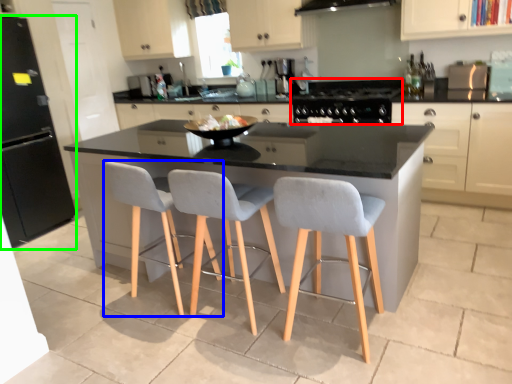
Question: Which object is positioned farthest from gas stove (highlighted by a red box)? Select from chair (highlighted by a blue box) and appliance (highlighted by a green box).

Choices:
 (A) chair
 (B) appliance

Answer: (B)